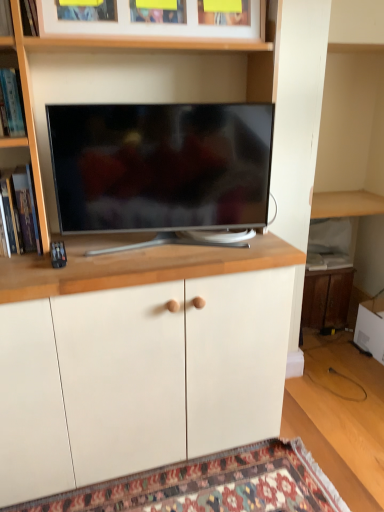
At what (x,y) coordinates should I click in order to perform the action: click on matte wood shelf at upper left, marked as the third shelf in a bottom-to-top arrangement. Please return your answer as a coordinate pair (x, y). Image resolution: width=384 pixels, height=512 pixels. Looking at the image, I should click on (6, 24).

What is the approximate height of wooden bookshelf at left, the 3th shelf from the top?

wooden bookshelf at left, the 3th shelf from the top, is 12.32 inches tall.

What is the approximate width of wooden shelf at upper left, marked as the 2th shelf in a top-to-bottom arrangement?

wooden shelf at upper left, marked as the 2th shelf in a top-to-bottom arrangement, is 26.76 centimeters in width.

This screenshot has width=384, height=512. Identify the location of hardcover book at left. (34, 210).

Does matte black tv at center appear on the right side of hardcover book at left?

Correct, you'll find matte black tv at center to the right of hardcover book at left.

From a real-world perspective, between matte black tv at center and hardcover book at left, who is vertically lower?

hardcover book at left.

Looking at this image, is matte black tv at center facing towards hardcover book at left?

No, matte black tv at center is not oriented towards hardcover book at left.

Based on the photo, is matte black tv at center far from hardcover book at left?

No, matte black tv at center is in close proximity to hardcover book at left.

Is point (201, 365) positioned after point (7, 104)?

Yes, point (201, 365) is farther from viewer.

From a real-world perspective, who is located lower, white matte cabinet at center, which ranks as the second cabinetry in right-to-left order, or wooden shelf at upper left, marked as the 2th shelf in a top-to-bottom arrangement?

From a 3D spatial view, white matte cabinet at center, which ranks as the second cabinetry in right-to-left order, is below.

Locate an element on the screen. This screenshot has height=512, width=384. the 2nd shelf positioned above the white matte cabinet at center, the second cabinetry in the back-to-front sequence (from a real-world perspective) is located at coordinates (11, 96).

Which object is wider, white matte cabinet at center, the second cabinetry in the back-to-front sequence, or wooden shelf at upper left, marked as the 2th shelf in a top-to-bottom arrangement?

white matte cabinet at center, the second cabinetry in the back-to-front sequence, is wider.

Considering the positions of objects matte black tv at center and matte wood shelf at upper left, positioned as the 1th shelf in top-to-bottom order, in the image provided, who is more to the left, matte black tv at center or matte wood shelf at upper left, positioned as the 1th shelf in top-to-bottom order,?

matte wood shelf at upper left, positioned as the 1th shelf in top-to-bottom order.

Does point (225, 116) appear closer or farther from the camera than point (1, 16)?

Point (225, 116) appears to be farther away from the viewer than point (1, 16).

Considering the sizes of objects matte black tv at center and matte wood shelf at upper left, marked as the third shelf in a bottom-to-top arrangement, in the image provided, who is shorter, matte black tv at center or matte wood shelf at upper left, marked as the third shelf in a bottom-to-top arrangement,?

Standing shorter between the two is matte wood shelf at upper left, marked as the third shelf in a bottom-to-top arrangement.

Which of these two, matte black tv at center or matte wood shelf at upper left, marked as the third shelf in a bottom-to-top arrangement, is thinner?

With smaller width is matte wood shelf at upper left, marked as the third shelf in a bottom-to-top arrangement.

In the scene shown: Is wooden picture frame at upper center further to camera compared to matte wood shelf at upper left, positioned as the 1th shelf in top-to-bottom order?

That is True.

From the image's perspective, which is above, wooden picture frame at upper center or matte wood shelf at upper left, marked as the third shelf in a bottom-to-top arrangement?

wooden picture frame at upper center.

Is point (260, 19) closer or farther from the camera than point (10, 34)?

Point (260, 19) is closer to the camera than point (10, 34).

Are wooden picture frame at upper center and matte wood shelf at upper left, positioned as the 1th shelf in top-to-bottom order, far apart?

wooden picture frame at upper center is near matte wood shelf at upper left, positioned as the 1th shelf in top-to-bottom order, not far away.

Image resolution: width=384 pixels, height=512 pixels. What are the coordinates of `mat below the hardcover book at left (from the image's perspective)` in the screenshot? It's located at (212, 486).

Based on the photo, is hardcover book at left surrounded by carpeted mat at lower center?

Definitely not — hardcover book at left is not inside carpeted mat at lower center.

Does carpeted mat at lower center lie in front of hardcover book at left?

Yes, carpeted mat at lower center is closer to the viewer.

Considering the sizes of carpeted mat at lower center and hardcover book at left in the image, is carpeted mat at lower center wider or thinner than hardcover book at left?

Clearly, carpeted mat at lower center has more width compared to hardcover book at left.

From the image's perspective, between matte wood shelf at upper left, positioned as the 1th shelf in top-to-bottom order, and wooden picture frame at upper center, who is located below?

matte wood shelf at upper left, positioned as the 1th shelf in top-to-bottom order.

Who is shorter, matte wood shelf at upper left, marked as the third shelf in a bottom-to-top arrangement, or wooden picture frame at upper center?

wooden picture frame at upper center is shorter.

Does matte wood shelf at upper left, positioned as the 1th shelf in top-to-bottom order, appear on the right side of wooden picture frame at upper center?

Incorrect, matte wood shelf at upper left, positioned as the 1th shelf in top-to-bottom order, is not on the right side of wooden picture frame at upper center.

From a real-world perspective, which is physically below, wooden cabinet at lower right, which ranks as the first cabinetry in back-to-front order, or wooden picture frame at upper center?

wooden cabinet at lower right, which ranks as the first cabinetry in back-to-front order.

Between point (337, 306) and point (239, 13), which one is positioned behind?

The point (337, 306) is behind.

How many degrees apart are the facing directions of wooden cabinet at lower right, which ranks as the first cabinetry in back-to-front order, and wooden picture frame at upper center?

They differ by 2.83 degrees in their facing directions.

The width and height of the screenshot is (384, 512). In order to click on book that is on the left side of matte black tv at center in this screenshot , I will do `click(34, 210)`.

Find the location of a particular element. The height and width of the screenshot is (512, 384). shelf that is the 2nd one above the white matte cabinet at center, which ranks as the second cabinetry in right-to-left order (from a real-world perspective) is located at coordinates (11, 96).

From the image, which object appears to be farther from wooden cabinet at lower right, which ranks as the 2th cabinetry in left-to-right order, matte black tv at center or wooden picture frame at upper center?

wooden picture frame at upper center.

Considering their positions, is wooden picture frame at upper center positioned further to white matte cabinet at center, acting as the first cabinetry starting from the front, than hardcover book at left?

wooden picture frame at upper center.

Which object lies nearer to the anchor point white matte cabinet at center, acting as the first cabinetry starting from the front, carpeted mat at lower center or hardcover book at left?

carpeted mat at lower center is closer to white matte cabinet at center, acting as the first cabinetry starting from the front.

Which object lies nearer to the anchor point wooden cabinet at lower right, which ranks as the 2th cabinetry in left-to-right order, matte wood shelf at upper left, positioned as the 1th shelf in top-to-bottom order, or carpeted mat at lower center?

Based on the image, carpeted mat at lower center appears to be nearer to wooden cabinet at lower right, which ranks as the 2th cabinetry in left-to-right order.

When comparing their distances from matte wood shelf at upper left, positioned as the 1th shelf in top-to-bottom order, does white matte cabinet at center, acting as the first cabinetry starting from the front, or wooden picture frame at upper center seem closer?

Based on the image, wooden picture frame at upper center appears to be nearer to matte wood shelf at upper left, positioned as the 1th shelf in top-to-bottom order.

Based on their spatial positions, is hardcover book at left or matte wood shelf at upper left, positioned as the 1th shelf in top-to-bottom order, closer to white matte cabinet at center, acting as the first cabinetry starting from the front?

hardcover book at left is positioned closer to the anchor white matte cabinet at center, acting as the first cabinetry starting from the front.

When comparing their distances from carpeted mat at lower center, does matte wood shelf at upper left, positioned as the 1th shelf in top-to-bottom order, or wooden cabinet at lower right, which is the second cabinetry from front to back, seem further?

matte wood shelf at upper left, positioned as the 1th shelf in top-to-bottom order, is positioned further to the anchor carpeted mat at lower center.

Based on their spatial positions, is carpeted mat at lower center or white matte cabinet at center, the second cabinetry in the back-to-front sequence, closer to matte wood shelf at upper left, marked as the third shelf in a bottom-to-top arrangement?

Among the two, white matte cabinet at center, the second cabinetry in the back-to-front sequence, is located nearer to matte wood shelf at upper left, marked as the third shelf in a bottom-to-top arrangement.

In order to click on television between matte wood shelf at upper left, positioned as the 1th shelf in top-to-bottom order, and wooden cabinet at lower right, arranged as the 1th cabinetry when viewed from the right in this screenshot , I will do `click(160, 166)`.

Locate an element on the screen. This screenshot has width=384, height=512. book between matte wood shelf at upper left, positioned as the 1th shelf in top-to-bottom order, and wooden bookshelf at left, the first shelf when ordered from bottom to top, in the vertical direction is located at coordinates (34, 210).

Identify the location of television between white matte cabinet at center, acting as the first cabinetry starting from the front, and wooden cabinet at lower right, arranged as the 1th cabinetry when viewed from the right, from front to back. Image resolution: width=384 pixels, height=512 pixels. (160, 166).

What are the coordinates of `television between wooden shelf at upper left, marked as the 2th shelf in a top-to-bottom arrangement, and white matte cabinet at center, placed as the 1th cabinetry when sorted from left to right, in the up-down direction` in the screenshot? It's located at (160, 166).